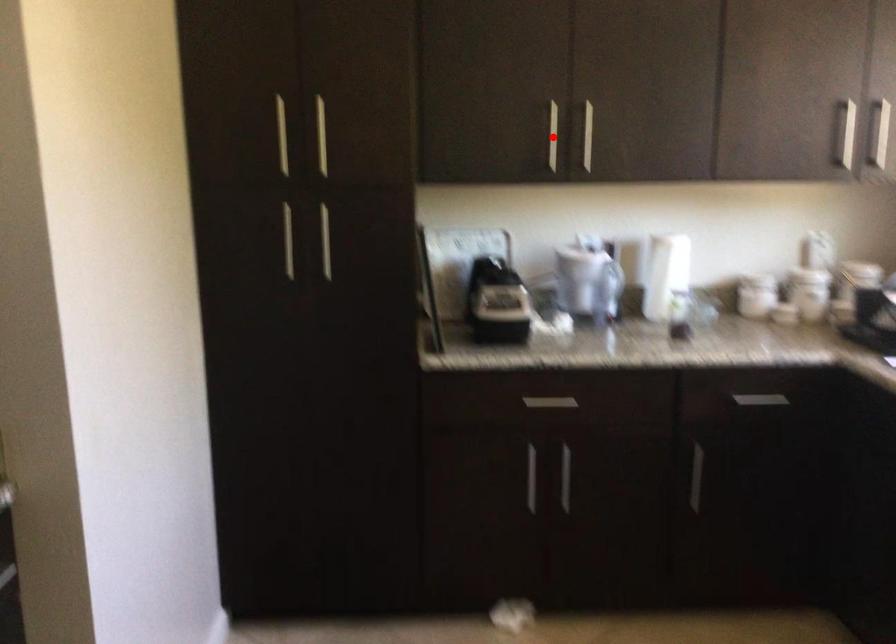
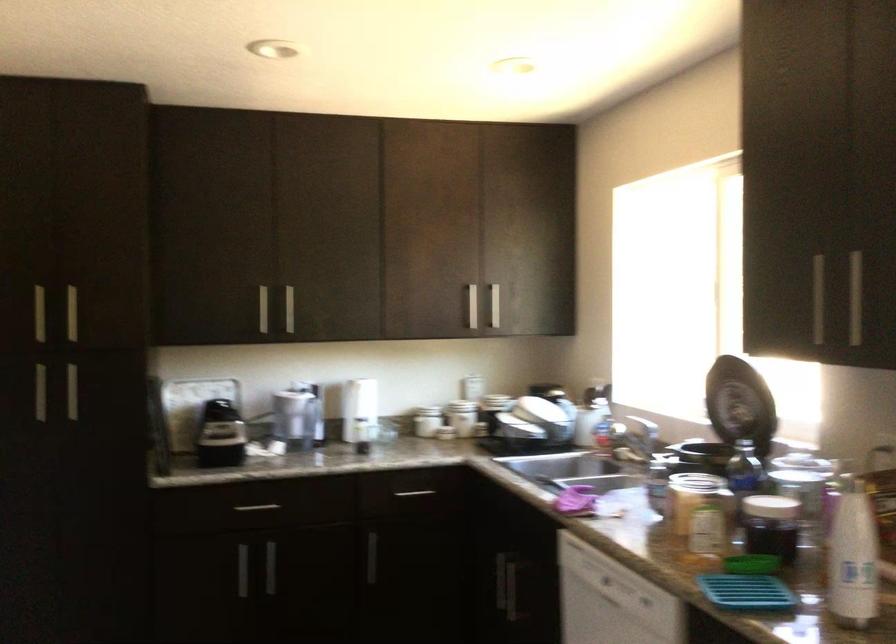
Question: A red point is marked in image1. In image2, is the corresponding 3D point closer to the camera or farther? Reply with the corresponding letter.

Choices:
 (A) The corresponding 3D point is closer.
 (B) The corresponding 3D point is farther.

Answer: (B)